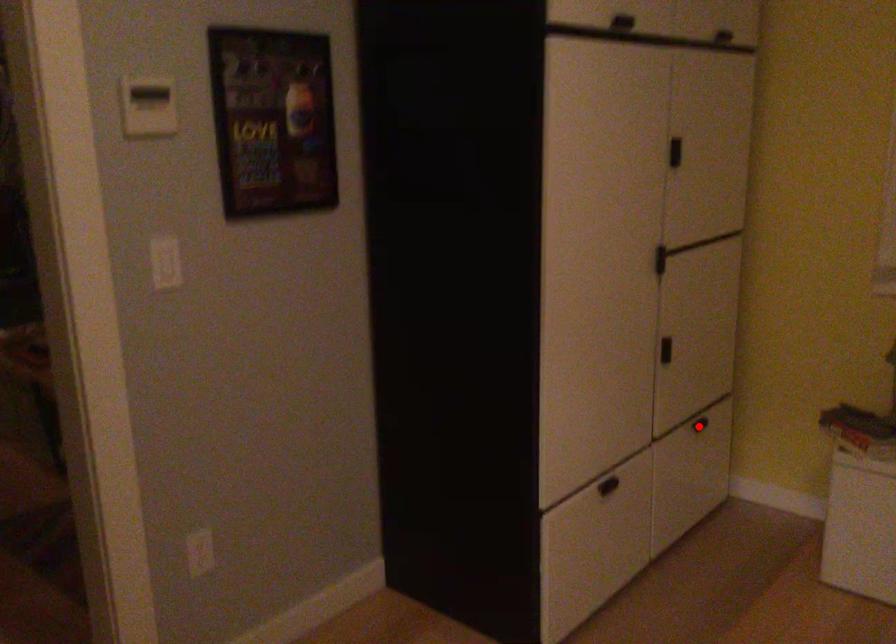
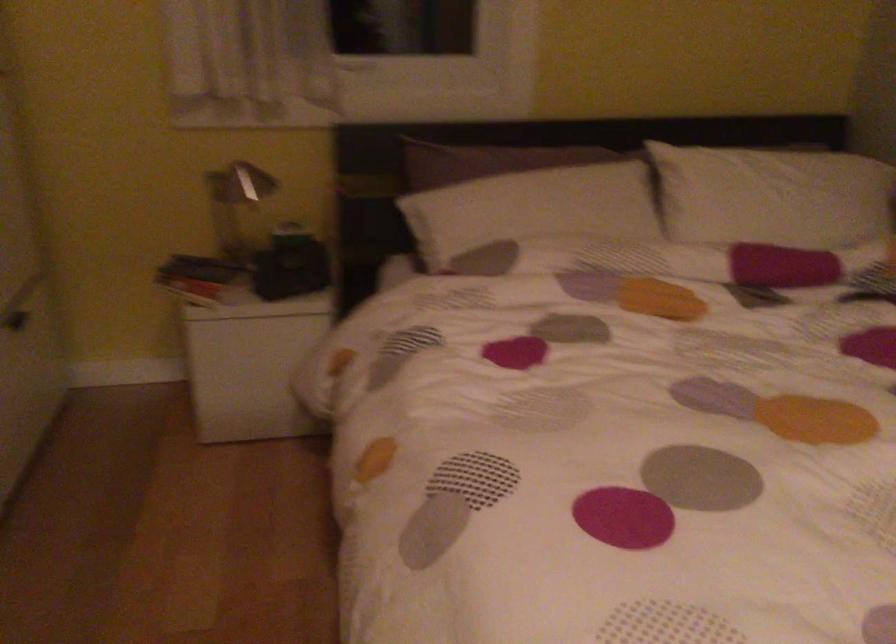
Question: I am providing you with two images of the same scene from different viewpoints. Image1 has a red point marked. In image2, the corresponding 3D location appears at what relative position? Reply with the corresponding letter.

Choices:
 (A) Closer
 (B) Farther

Answer: (A)